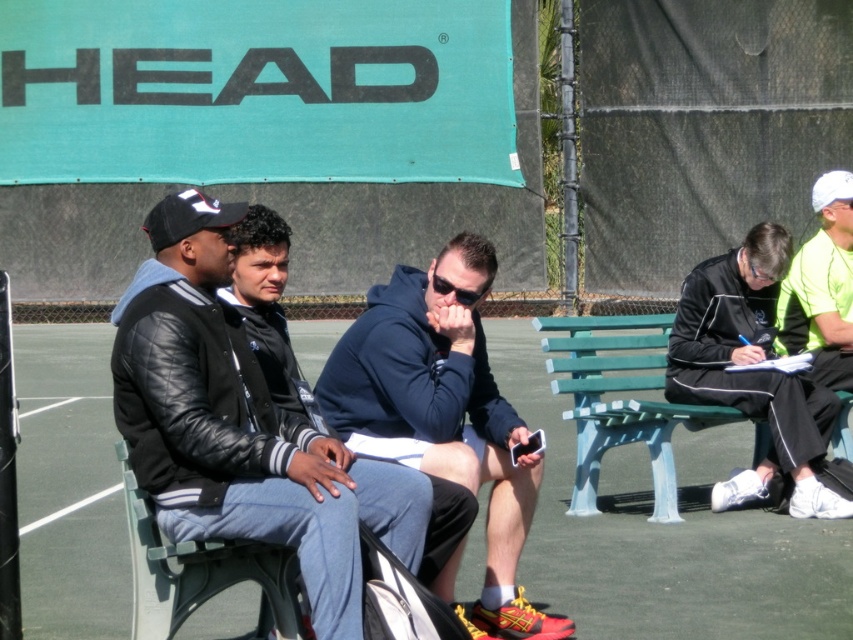
Question: Which of the following is the closest to the observer?

Choices:
 (A) green plastic bench at right
 (B) black leather jacket at right
 (C) black leather jacket at left

Answer: (C)

Question: Which point is farther to the camera?

Choices:
 (A) black leather jacket at left
 (B) green plastic bench at right
 (C) navy blue hoodie at center

Answer: (B)

Question: Does black leather jacket at left have a larger size compared to green plastic bench at right?

Choices:
 (A) no
 (B) yes

Answer: (A)

Question: Estimate the real-world distances between objects in this image. Which object is closer to the neon green shirt at right?

Choices:
 (A) green plastic bench at right
 (B) black leather jacket at right
 (C) navy blue hoodie at center

Answer: (B)

Question: Considering the relative positions of navy blue hoodie at center and black leather jacket at right in the image provided, where is navy blue hoodie at center located with respect to black leather jacket at right?

Choices:
 (A) above
 (B) below

Answer: (B)

Question: Is the position of black leather jacket at right less distant than that of green plastic bench at right?

Choices:
 (A) yes
 (B) no

Answer: (B)